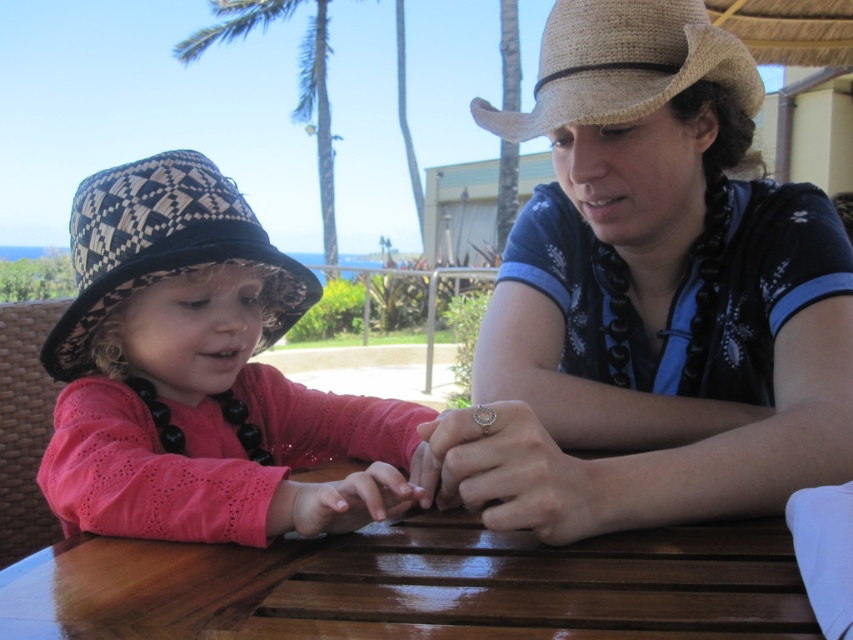
Does matte black hat at left have a smaller size compared to black and white woven straw hat at left?

No.

Which of these two, matte black hat at left or black and white woven straw hat at left, stands taller?

With more height is matte black hat at left.

Where is `matte black hat at left`? matte black hat at left is located at coordinates (198, 374).

Locate an element on the screen. Image resolution: width=853 pixels, height=640 pixels. matte black hat at left is located at coordinates (198, 374).

From the picture: Can you confirm if rustic straw hat at upper right is shorter than woven straw cowboy hat at upper right?

No.

Which is in front, point (828, 289) or point (611, 61)?

Point (611, 61) is in front.

In the scene shown: Who is more distant from viewer, (651,125) or (563,81)?

The point (651,125) is more distant.

The width and height of the screenshot is (853, 640). I want to click on rustic straw hat at upper right, so click(x=648, y=298).

Is rustic straw hat at upper right taller than shiny brown wood table at center?

Yes, rustic straw hat at upper right is taller than shiny brown wood table at center.

Is rustic straw hat at upper right further to the viewer compared to shiny brown wood table at center?

Yes, it is.

Is point (641, 122) closer to camera compared to point (741, 525)?

No.

Where is `rustic straw hat at upper right`? The width and height of the screenshot is (853, 640). rustic straw hat at upper right is located at coordinates (648, 298).